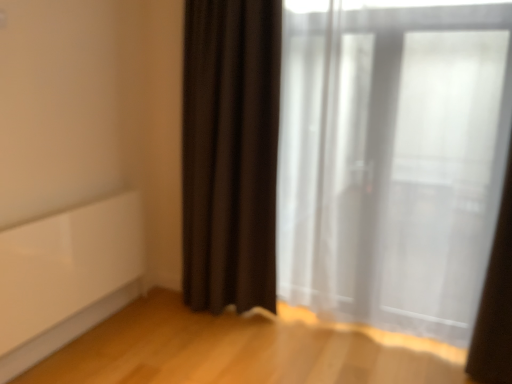
Question: Is white sheer curtain at right, which is the second curtain in left-to-right order, smaller than white sheer curtain at right, which is the 1th curtain from left to right?

Choices:
 (A) yes
 (B) no

Answer: (A)

Question: Is white sheer curtain at right, acting as the second curtain starting from the right, located within white sheer curtain at right, the 1th curtain positioned from the right?

Choices:
 (A) yes
 (B) no

Answer: (B)

Question: Does white sheer curtain at right, which is the second curtain in left-to-right order, have a larger size compared to white sheer curtain at right, which is the 1th curtain from left to right?

Choices:
 (A) yes
 (B) no

Answer: (B)

Question: Considering the relative sizes of white sheer curtain at right, the 1th curtain positioned from the right, and white sheer curtain at right, which is the 1th curtain from left to right, in the image provided, is white sheer curtain at right, the 1th curtain positioned from the right, taller than white sheer curtain at right, which is the 1th curtain from left to right,?

Choices:
 (A) no
 (B) yes

Answer: (A)

Question: From the image's perspective, is white sheer curtain at right, the 1th curtain positioned from the right, over white sheer curtain at right, acting as the second curtain starting from the right?

Choices:
 (A) yes
 (B) no

Answer: (B)

Question: Is white sheer curtain at right, the 1th curtain positioned from the right, turned away from white sheer curtain at right, which is the 1th curtain from left to right?

Choices:
 (A) yes
 (B) no

Answer: (B)

Question: Can you confirm if white sheer curtain at right, acting as the second curtain starting from the right, is shorter than white sheer curtain at right, the 1th curtain positioned from the right?

Choices:
 (A) yes
 (B) no

Answer: (B)

Question: Considering the relative sizes of white sheer curtain at right, which is the 1th curtain from left to right, and white sheer curtain at right, which is the second curtain in left-to-right order, in the image provided, is white sheer curtain at right, which is the 1th curtain from left to right, bigger than white sheer curtain at right, which is the second curtain in left-to-right order,?

Choices:
 (A) no
 (B) yes

Answer: (B)

Question: Does white sheer curtain at right, acting as the second curtain starting from the right, have a greater height compared to white sheer curtain at right, which is the second curtain in left-to-right order?

Choices:
 (A) yes
 (B) no

Answer: (A)

Question: Is white sheer curtain at right, which is the 1th curtain from left to right, with white sheer curtain at right, the 1th curtain positioned from the right?

Choices:
 (A) no
 (B) yes

Answer: (A)

Question: Is white sheer curtain at right, acting as the second curtain starting from the right, smaller than white sheer curtain at right, the 1th curtain positioned from the right?

Choices:
 (A) yes
 (B) no

Answer: (B)

Question: Would you say white sheer curtain at right, acting as the second curtain starting from the right, contains white sheer curtain at right, which is the second curtain in left-to-right order?

Choices:
 (A) yes
 (B) no

Answer: (B)

Question: Based on their positions, is white sheer curtain at right, acting as the second curtain starting from the right, located to the left or right of white sheer curtain at right, which is the second curtain in left-to-right order?

Choices:
 (A) right
 (B) left

Answer: (B)